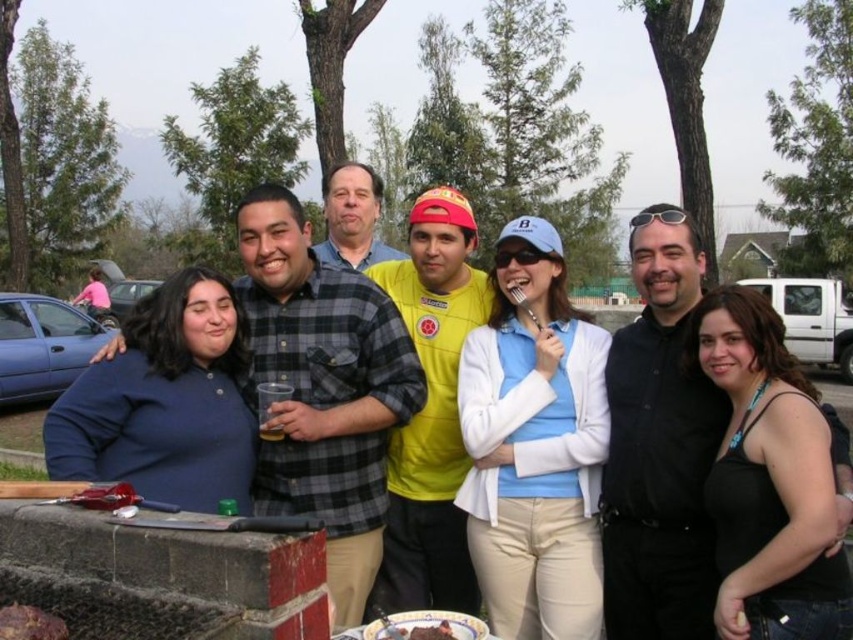
Question: Is matte blue shirt at center further to the viewer compared to chocolate cake at center?

Choices:
 (A) no
 (B) yes

Answer: (B)

Question: Based on their relative distances, which object is nearer to the matte blue shirt at center?

Choices:
 (A) smooth chocolate cake at lower left
 (B) chocolate cake at center

Answer: (A)

Question: Can you confirm if matte blue shirt at center is positioned to the right of chocolate cake at center?

Choices:
 (A) yes
 (B) no

Answer: (B)

Question: Can you confirm if chocolate cake at center is positioned to the left of smooth chocolate cake at lower left?

Choices:
 (A) yes
 (B) no

Answer: (B)

Question: Which point is closer to the camera?

Choices:
 (A) (445, 316)
 (B) (9, 625)

Answer: (B)

Question: Which point is closer to the camera?

Choices:
 (A) (22, 627)
 (B) (343, 256)
 (C) (401, 612)

Answer: (A)